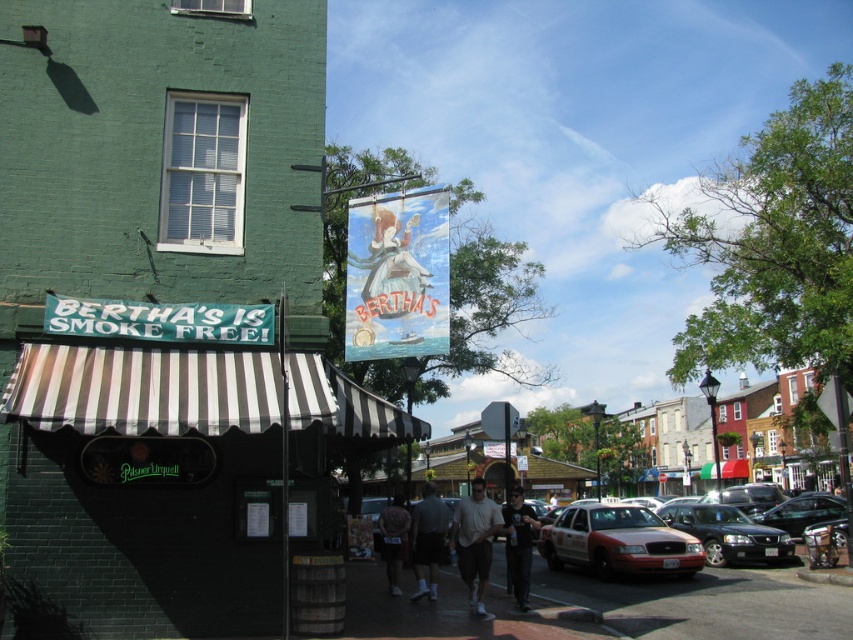
Question: Which of these objects is positioned closest to the shiny black sedan at center?

Choices:
 (A) smooth asphalt road at center
 (B) muscular skin at center

Answer: (A)

Question: From the image, what is the correct spatial relationship of metallic red taxi at center in relation to muscular skin at center?

Choices:
 (A) above
 (B) below

Answer: (B)

Question: Where is white cotton t-shirt at center located in relation to dark gray t-shirt at center in the image?

Choices:
 (A) below
 (B) above

Answer: (B)

Question: Which object appears farthest from the camera in this image?

Choices:
 (A) muscular skin at center
 (B) dark gray t-shirt at center

Answer: (A)

Question: Which object appears farthest from the camera in this image?

Choices:
 (A) gray fabric shorts at center
 (B) metallic red taxi at center
 (C) dark gray t-shirt at center

Answer: (B)

Question: Does metallic red taxi at center appear on the left side of white cotton t-shirt at center?

Choices:
 (A) no
 (B) yes

Answer: (A)